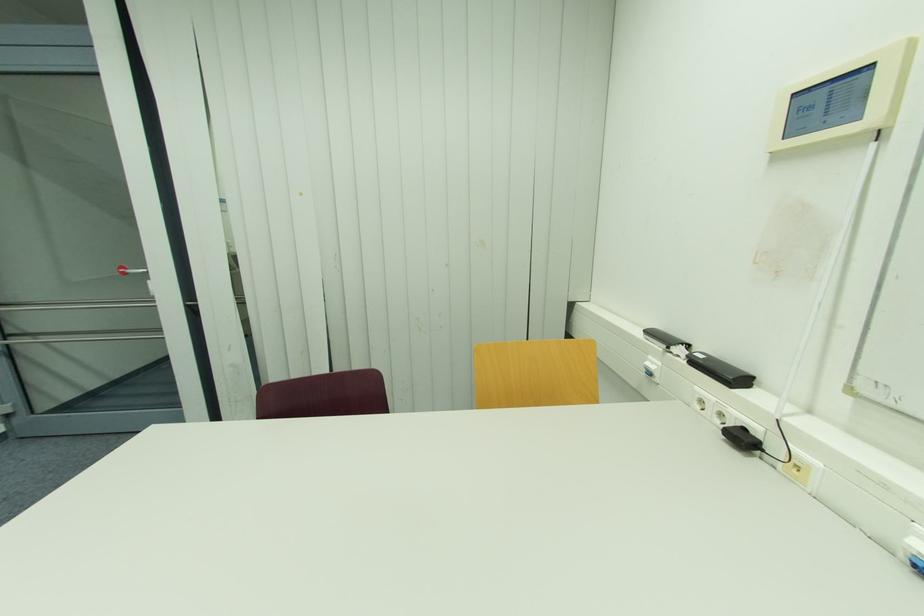
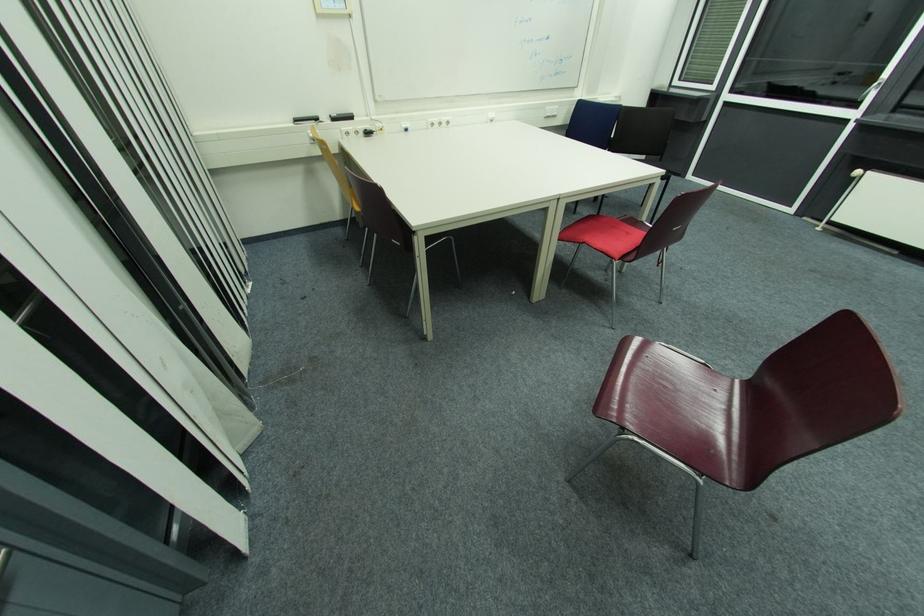
Where in the second image is the point corresponding to point 652,334 from the first image?

(300, 121)